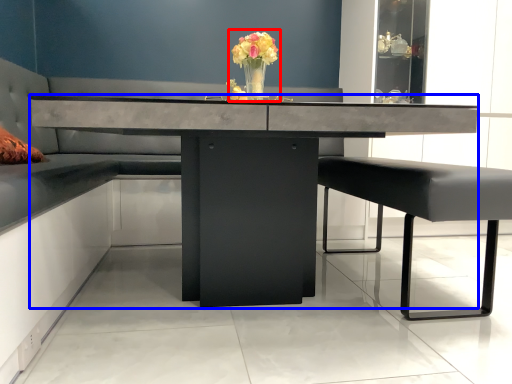
Question: Which of the following is the farthest to the observer, floral arrangement (highlighted by a red box) or table (highlighted by a blue box)?

Choices:
 (A) floral arrangement
 (B) table

Answer: (A)